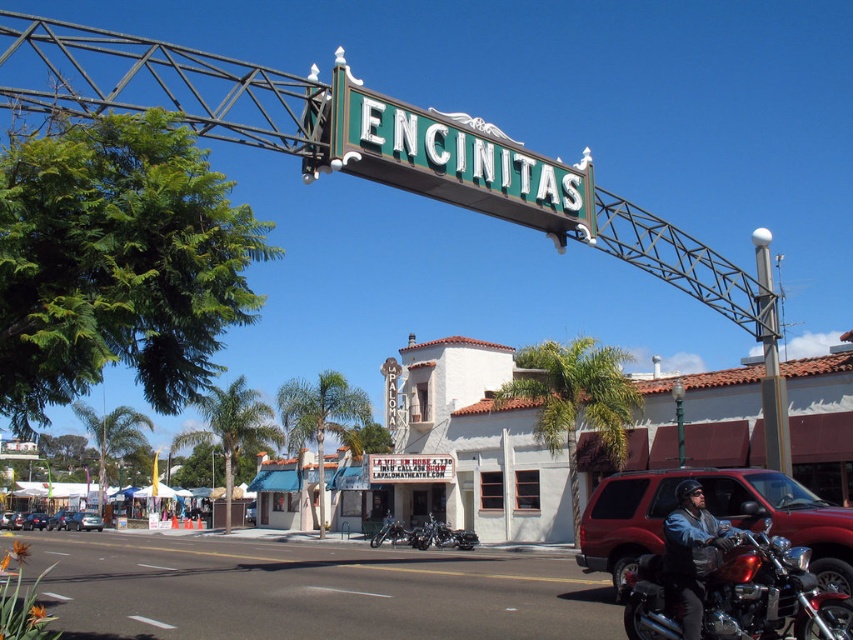
Question: Which object appears closest to the camera in this image?

Choices:
 (A) leather jacket at center
 (B) matte black car at lower left

Answer: (A)

Question: Is shiny chrome motorcycle at lower right thinner than leather jacket at center?

Choices:
 (A) yes
 (B) no

Answer: (B)

Question: Is the position of shiny chrome motorcycle at lower right less distant than that of metallic silver sedan at lower left?

Choices:
 (A) no
 (B) yes

Answer: (B)

Question: Among these points, which one is farthest from the camera?

Choices:
 (A) (759, 611)
 (B) (21, 525)
 (C) (91, 513)

Answer: (C)

Question: Can you confirm if metallic silver sedan at lower left is smaller than matte black car at lower left?

Choices:
 (A) yes
 (B) no

Answer: (A)

Question: Which object is closer to the camera taking this photo?

Choices:
 (A) green metallic sign at center
 (B) metallic silver sedan at center
 (C) metallic silver sedan at lower left
 (D) leather jacket at center

Answer: (D)